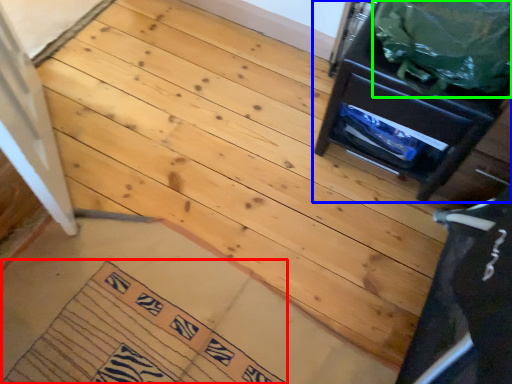
Question: Which object is the closest to the doormat (highlighted by a red box)? Choose among these: furniture (highlighted by a blue box) or garbage (highlighted by a green box).

Choices:
 (A) furniture
 (B) garbage

Answer: (A)